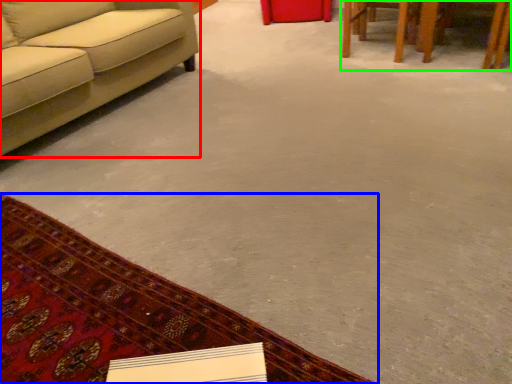
Question: Which is farther away from studio couch (highlighted by a red box)? mat (highlighted by a blue box) or table (highlighted by a green box)?

Choices:
 (A) mat
 (B) table

Answer: (B)